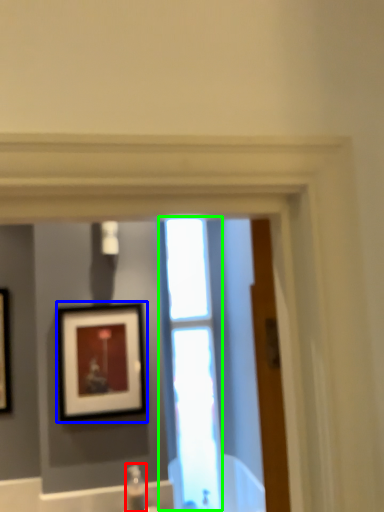
Question: Based on their relative distances, which object is farther from plumbing fixture (highlighted by a red box)? Choose from picture frame (highlighted by a blue box) and window (highlighted by a green box).

Choices:
 (A) picture frame
 (B) window

Answer: (B)